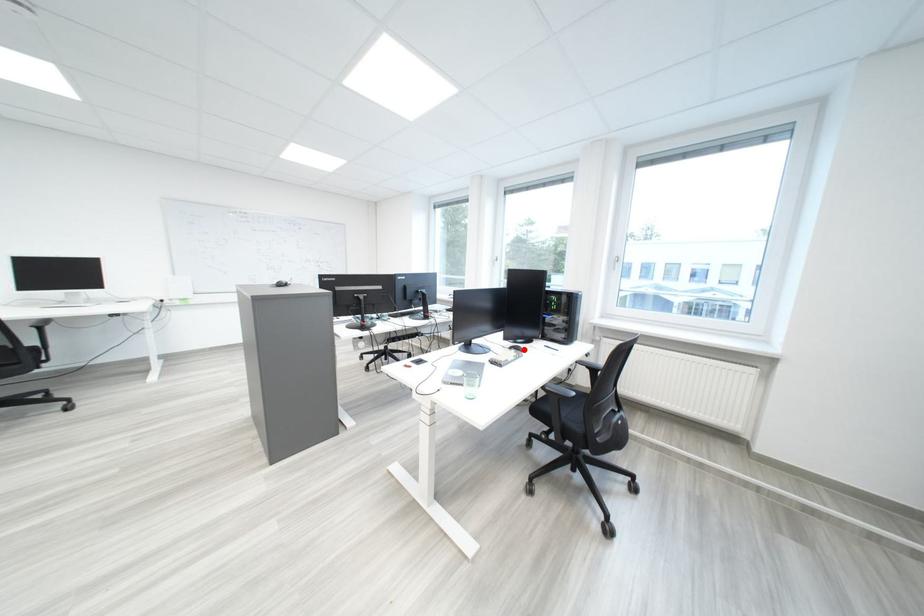
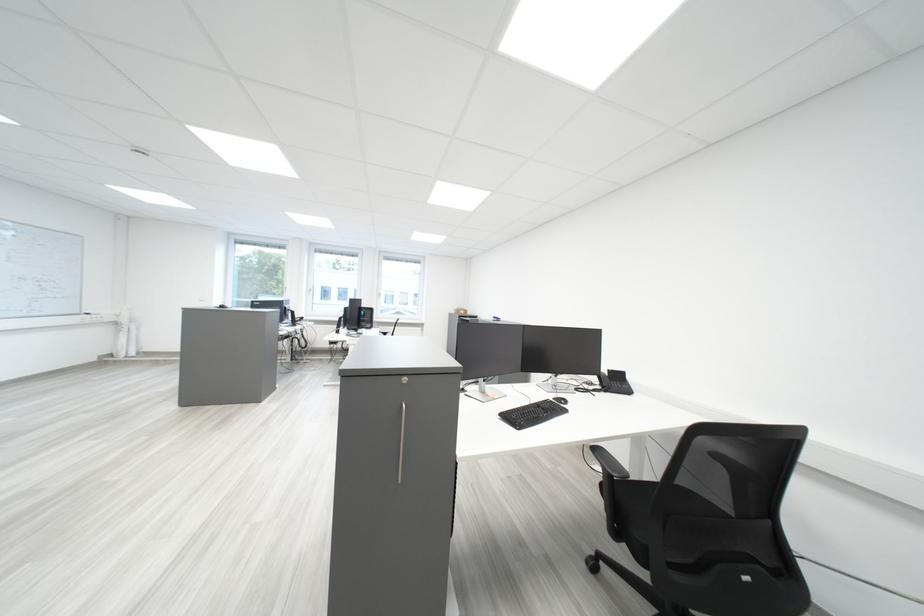
Question: I am providing you with two images of the same scene from different viewpoints. A red point is marked on the first image. Is the red point's position out of view in image 2?

Choices:
 (A) Yes
 (B) No

Answer: (A)